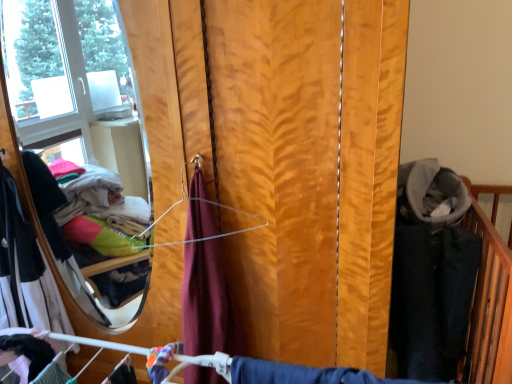
Question: Is white cotton dress at left, acting as the second clothing starting from the right, inside wooden blinds at center?

Choices:
 (A) yes
 (B) no

Answer: (B)

Question: Does wooden blinds at center have a lesser height compared to white cotton dress at left, acting as the second clothing starting from the right?

Choices:
 (A) no
 (B) yes

Answer: (A)

Question: From a real-world perspective, is wooden blinds at center on white cotton dress at left, acting as the second clothing starting from the right?

Choices:
 (A) no
 (B) yes

Answer: (B)

Question: Can you confirm if wooden blinds at center is positioned to the right of white cotton dress at left, the second clothing positioned from the front?

Choices:
 (A) yes
 (B) no

Answer: (A)

Question: Considering the relative sizes of wooden blinds at center and white cotton dress at left, which ranks as the 1th clothing in left-to-right order, in the image provided, is wooden blinds at center wider than white cotton dress at left, which ranks as the 1th clothing in left-to-right order,?

Choices:
 (A) yes
 (B) no

Answer: (A)

Question: In terms of width, does white cotton dress at left, the second clothing positioned from the front, look wider or thinner when compared to matte black fabric at lower left, marked as the 1th clothing in a front-to-back arrangement?

Choices:
 (A) thin
 (B) wide

Answer: (B)

Question: Does point coord(12,299) appear closer or farther from the camera than point coord(47,349)?

Choices:
 (A) closer
 (B) farther

Answer: (B)

Question: From their relative heights in the image, would you say white cotton dress at left, the second clothing positioned from the front, is taller or shorter than matte black fabric at lower left, the second clothing in the left-to-right sequence?

Choices:
 (A) short
 (B) tall

Answer: (B)

Question: Would you say white cotton dress at left, acting as the second clothing starting from the right, is inside or outside matte black fabric at lower left, marked as the 1th clothing in a front-to-back arrangement?

Choices:
 (A) inside
 (B) outside

Answer: (B)

Question: From a real-world perspective, is matte black fabric at lower left, marked as the 1th clothing in a front-to-back arrangement, above or below white cotton dress at left, which ranks as the 1th clothing in left-to-right order?

Choices:
 (A) below
 (B) above

Answer: (A)

Question: Looking at the image, does matte black fabric at lower left, the second clothing positioned from the back, seem bigger or smaller compared to white cotton dress at left, acting as the second clothing starting from the right?

Choices:
 (A) big
 (B) small

Answer: (B)

Question: In the image, is matte black fabric at lower left, which ranks as the 1th clothing in right-to-left order, positioned in front of or behind white cotton dress at left, the second clothing positioned from the front?

Choices:
 (A) behind
 (B) front

Answer: (B)

Question: Does point (5, 336) appear closer or farther from the camera than point (66, 327)?

Choices:
 (A) closer
 (B) farther

Answer: (A)

Question: From the image's perspective, is matte black fabric at lower left, which ranks as the 1th clothing in right-to-left order, located above or below wooden blinds at center?

Choices:
 (A) below
 (B) above

Answer: (A)

Question: In the image, is matte black fabric at lower left, which ranks as the 1th clothing in right-to-left order, positioned in front of or behind wooden blinds at center?

Choices:
 (A) behind
 (B) front

Answer: (B)